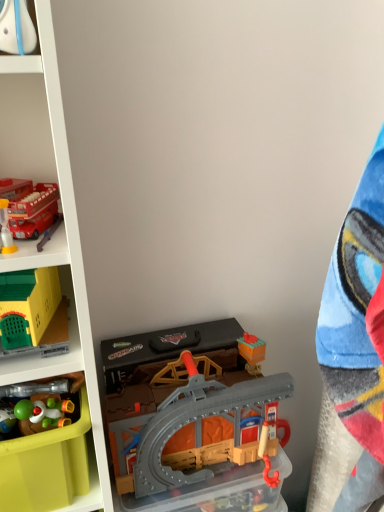
Question: Does matte red bus at upper left, which ranks as the fourth toy in left-to-right order, have a greater height compared to shiny plastic toy at lower left, the third toy viewed from the left?

Choices:
 (A) no
 (B) yes

Answer: (B)

Question: Considering the relative sizes of matte red bus at upper left, which ranks as the fourth toy in left-to-right order, and shiny plastic toy at lower left, the 3th toy from the right, in the image provided, is matte red bus at upper left, which ranks as the fourth toy in left-to-right order, bigger than shiny plastic toy at lower left, the 3th toy from the right,?

Choices:
 (A) yes
 (B) no

Answer: (A)

Question: From the image's perspective, is matte red bus at upper left, which ranks as the fourth toy in left-to-right order, above shiny plastic toy at lower left, the 3th toy from the right?

Choices:
 (A) no
 (B) yes

Answer: (B)

Question: Are matte red bus at upper left, marked as the second toy in a right-to-left arrangement, and shiny plastic toy at lower left, the 3th toy from the right, far apart?

Choices:
 (A) yes
 (B) no

Answer: (B)

Question: Does matte red bus at upper left, which ranks as the fourth toy in left-to-right order, have a lesser height compared to shiny plastic toy at lower left, the third toy viewed from the left?

Choices:
 (A) yes
 (B) no

Answer: (B)

Question: Does matte red bus at upper left, which ranks as the fourth toy in left-to-right order, have a lesser width compared to shiny plastic toy at lower left, the third toy viewed from the left?

Choices:
 (A) no
 (B) yes

Answer: (A)

Question: Would you consider translucent plastic storage box at center, which is the first storage box in right-to-left order, to be distant from matte red bus at upper left, marked as the second toy in a right-to-left arrangement?

Choices:
 (A) no
 (B) yes

Answer: (A)

Question: Is translucent plastic storage box at center, which is the first storage box in right-to-left order, positioned behind matte red bus at upper left, which ranks as the fourth toy in left-to-right order?

Choices:
 (A) no
 (B) yes

Answer: (B)

Question: Does translucent plastic storage box at center, which is the 2th storage box from left to right, contain matte red bus at upper left, which ranks as the fourth toy in left-to-right order?

Choices:
 (A) no
 (B) yes

Answer: (A)

Question: Is translucent plastic storage box at center, which is the first storage box in right-to-left order, looking in the opposite direction of matte red bus at upper left, which ranks as the fourth toy in left-to-right order?

Choices:
 (A) no
 (B) yes

Answer: (A)

Question: Is translucent plastic storage box at center, which is the 2th storage box from left to right, next to matte red bus at upper left, which ranks as the fourth toy in left-to-right order?

Choices:
 (A) yes
 (B) no

Answer: (B)

Question: From the image's perspective, would you say translucent plastic storage box at center, which is the 2th storage box from left to right, is positioned over matte red bus at upper left, marked as the second toy in a right-to-left arrangement?

Choices:
 (A) no
 (B) yes

Answer: (A)

Question: Considering the relative positions of matte green plastic storage box at lower left, the second storage box from the right, and plastic/grey track at lower center, which is the first toy in right-to-left order, in the image provided, is matte green plastic storage box at lower left, the second storage box from the right, to the right of plastic/grey track at lower center, which is the first toy in right-to-left order, from the viewer's perspective?

Choices:
 (A) no
 (B) yes

Answer: (A)